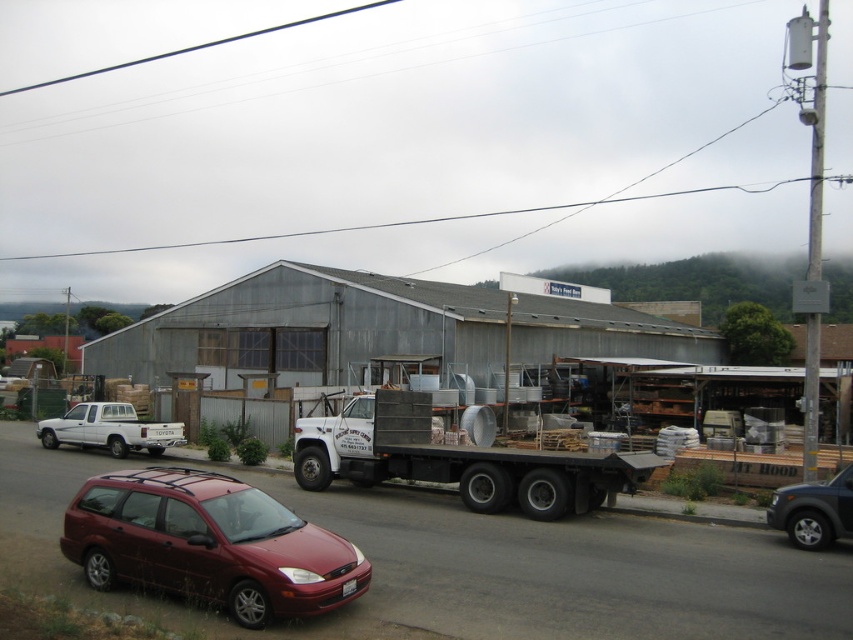
You are standing at the entrance of the warehouse and see two points marked on the ground. The first point is labeled as point (459, 456) and the second is point (851, 515). Which point is closer to you?

Point (459, 456) is closer to you because it is further to the viewer than point (851, 515).

You are standing at the entrance of the warehouse and see the point marked at coordinates (456, 460). What object is located at that point?

The point at coordinates (456, 460) indicates the metallic flatbed truck at center.

You are a delivery driver who needs to unload a package from the flatbed truck. The package is located at point (558,484) and another item at point (146,433). Which item is closer to the front of the truck?

Point (558,484) is in front of point (146,433), so the package at point (558,484) is closer to the front of the truck.